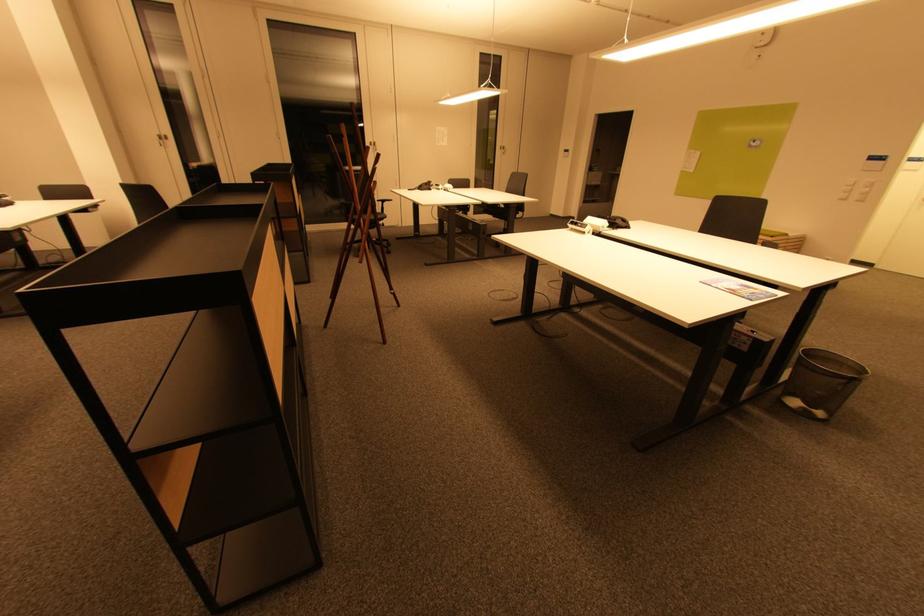
You are a GUI agent. You are given a task and a screenshot of the screen. Output one action in this format:
    pyautogui.click(x=<x>, y=<y>)
    Task: Click on the door handle
    This screenshot has width=924, height=616.
    Given the screenshot: What is the action you would take?
    pyautogui.click(x=162, y=139)